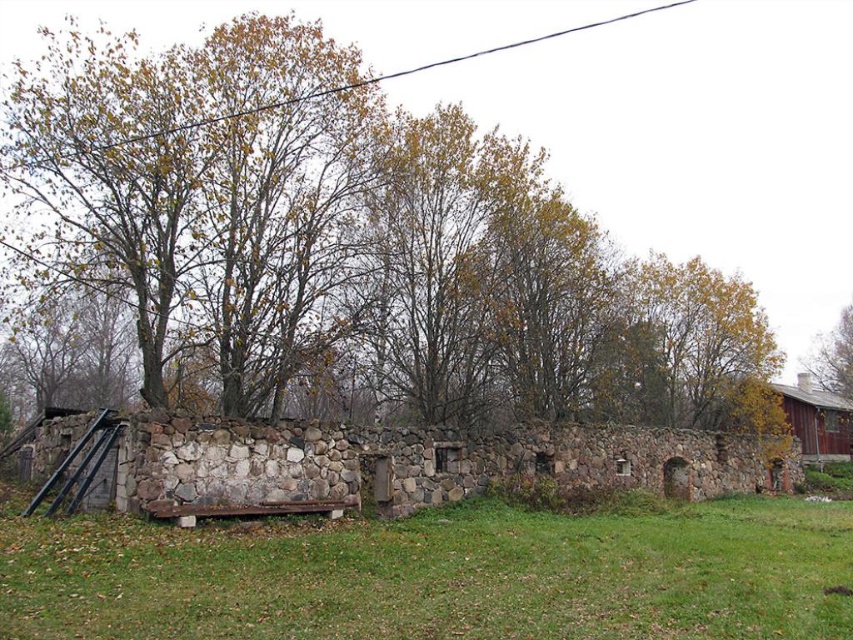
Question: Does brown leafy tree at upper left appear on the right side of brown wooden barn at right?

Choices:
 (A) no
 (B) yes

Answer: (A)

Question: Which point is closer to the camera taking this photo?

Choices:
 (A) (389, 561)
 (B) (838, 433)
 (C) (844, 360)

Answer: (A)

Question: Does brown wooden barn at right have a greater width compared to brown leafy tree at upper right?

Choices:
 (A) no
 (B) yes

Answer: (B)

Question: Is brown leafy tree at upper left smaller than green grass at lower center?

Choices:
 (A) yes
 (B) no

Answer: (B)

Question: Based on their relative distances, which object is farther from the brown leafy tree at upper left?

Choices:
 (A) brown wooden barn at right
 (B) brown leafy tree at upper right

Answer: (B)

Question: Based on their relative distances, which object is farther from the brown wooden barn at right?

Choices:
 (A) brown leafy tree at upper left
 (B) green grass at lower center

Answer: (B)